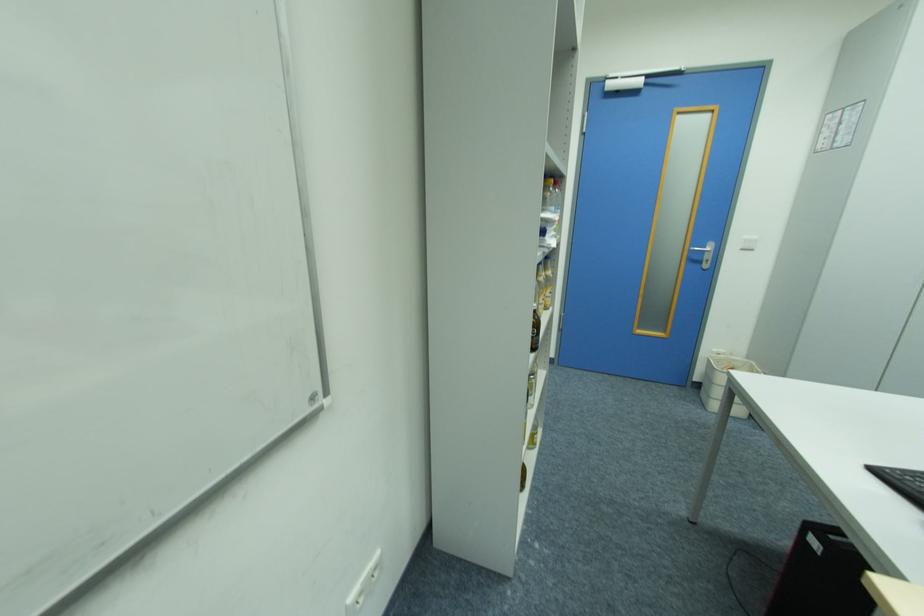
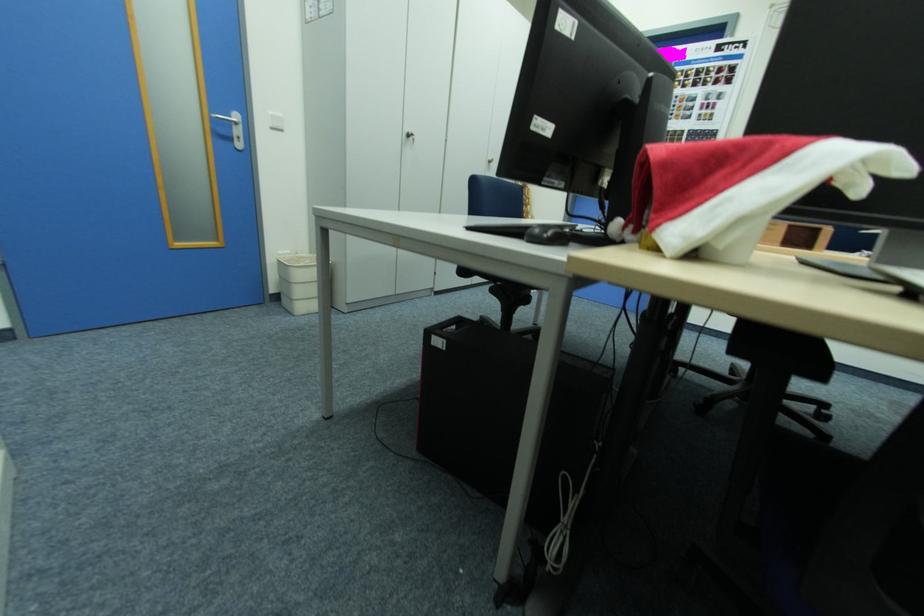
The point at (x=722, y=352) is marked in the first image. Where is the corresponding point in the second image?

(286, 254)